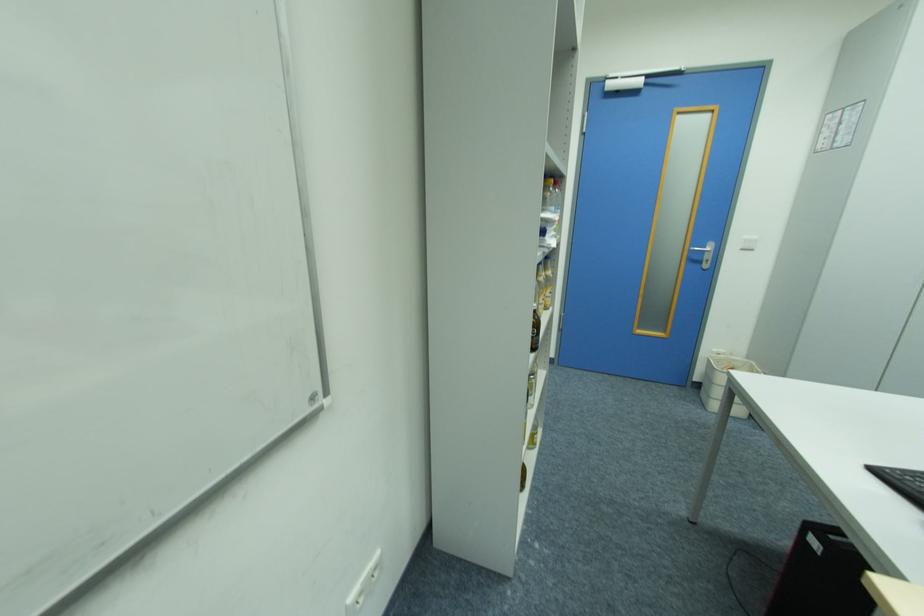
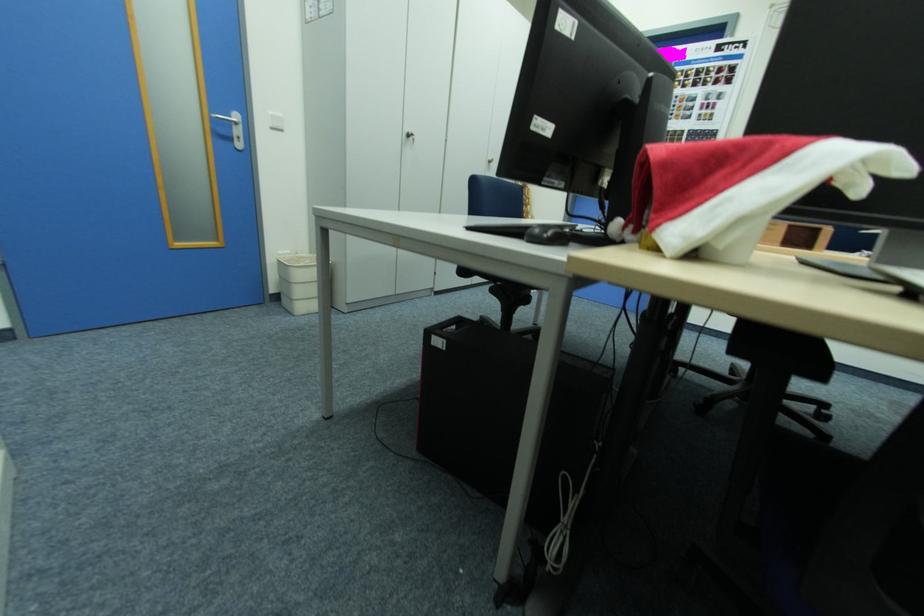
The point at (x=722, y=352) is marked in the first image. Where is the corresponding point in the second image?

(286, 254)